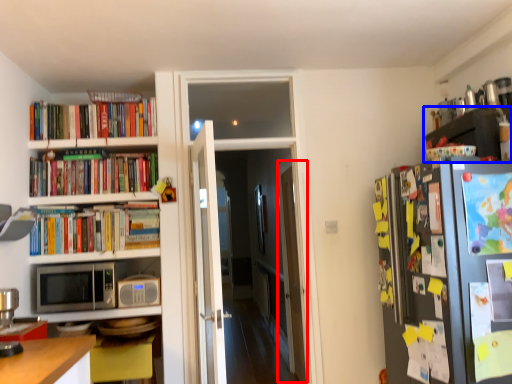
Question: Which point is closer to the camera, glass door (highlighted by a red box) or shelf (highlighted by a blue box)?

Choices:
 (A) glass door
 (B) shelf

Answer: (B)